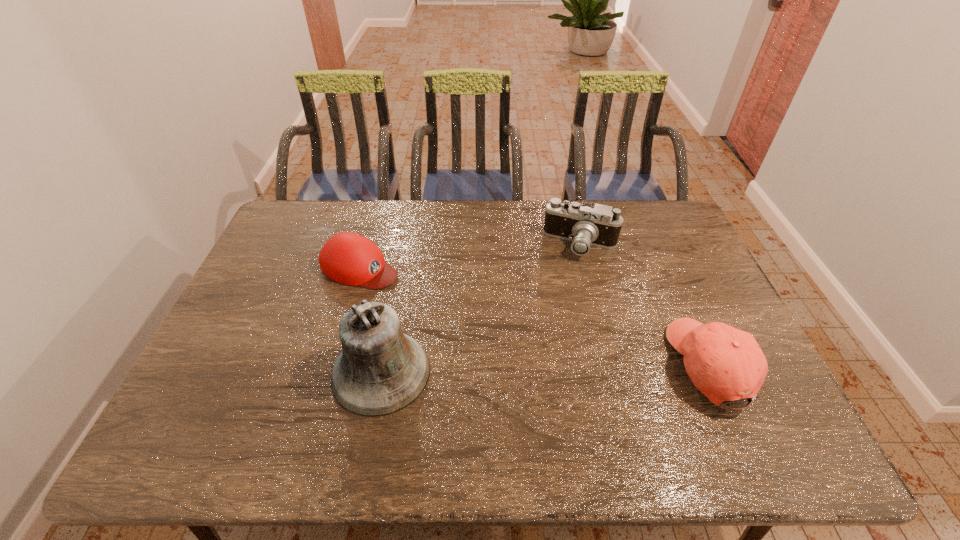
Identify the location of the tallest object. Image resolution: width=960 pixels, height=540 pixels. (381, 370).

This screenshot has height=540, width=960. In order to click on the taller baseball cap in this screenshot , I will do `click(726, 364)`.

Find the location of a particular element. the nearer baseball cap is located at coordinates (726, 364).

This screenshot has width=960, height=540. In order to click on the farther baseball cap in this screenshot , I will do `click(348, 258)`.

Identify the location of the shortest object. The image size is (960, 540). (348, 258).

What are the coordinates of `the third object from left to right` in the screenshot? It's located at (588, 224).

Where is `free space located 0.200m on the right of the bell`? This screenshot has width=960, height=540. free space located 0.200m on the right of the bell is located at coordinates (509, 372).

At what (x,y) coordinates should I click in order to perform the action: click on free region located 0.310m on the left of the taller baseball cap. Please return your answer as a coordinate pair (x, y). The image size is (960, 540). Looking at the image, I should click on click(x=555, y=366).

The width and height of the screenshot is (960, 540). I want to click on vacant space situated 0.080m on the front-facing side of the shortest object, so click(413, 288).

Identify the location of vacant space situated 0.150m on the front-facing side of the shortest object. (431, 296).